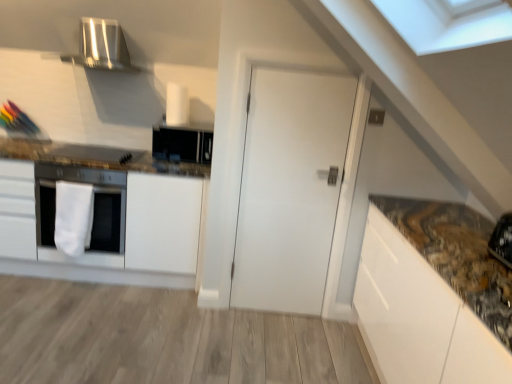
Describe the element at coordinates (93, 213) in the screenshot. I see `white matte oven at left` at that location.

The height and width of the screenshot is (384, 512). I want to click on white fabric towel at left, so click(x=73, y=217).

This screenshot has width=512, height=384. Find the location of `black matte microwave at upper center`. black matte microwave at upper center is located at coordinates (182, 144).

In order to face white matte cabinet at left, should I rotate leftwards or rightwards?

It's best to rotate left around 21.046 degrees.

This screenshot has width=512, height=384. Identify the location of white matte oven at left. (93, 213).

Is white fabric towel at left turned away from satin silver exhaust hood at upper left?

No, white fabric towel at left is not facing away from satin silver exhaust hood at upper left.

Visually, is white fabric towel at left positioned to the left or to the right of satin silver exhaust hood at upper left?

white fabric towel at left is positioned on satin silver exhaust hood at upper left's left side.

Which object is further away from the camera, white fabric towel at left or satin silver exhaust hood at upper left?

satin silver exhaust hood at upper left is more distant.

Is point (82, 196) closer to camera compared to point (88, 52)?

Yes, it is.

Where is `oven behind the white fabric towel at left`? oven behind the white fabric towel at left is located at coordinates (93, 213).

Is white fabric towel at left positioned behind white matte oven at left?

No, it is in front of white matte oven at left.

From a real-world perspective, which is physically above, white fabric towel at left or white matte oven at left?

In real-world perspective, white matte oven at left is above.

Is white fabric towel at left oriented away from white matte oven at left?

Yes, white matte oven at left is at the back of white fabric towel at left.

Looking at this image, between satin silver exhaust hood at upper left and black matte microwave at upper center, which one has smaller width?

black matte microwave at upper center is thinner.

Is satin silver exhaust hood at upper left placed right next to black matte microwave at upper center?

No, satin silver exhaust hood at upper left is not beside black matte microwave at upper center.

From the image's perspective, relative to black matte microwave at upper center, is satin silver exhaust hood at upper left above or below?

satin silver exhaust hood at upper left is situated higher than black matte microwave at upper center in the image.

Between satin silver exhaust hood at upper left and black matte microwave at upper center, which one has larger size?

With larger size is satin silver exhaust hood at upper left.

Does white matte oven at left have a larger size compared to satin silver exhaust hood at upper left?

Correct, white matte oven at left is larger in size than satin silver exhaust hood at upper left.

Which is farther, (90,261) or (126,51)?

The point (126,51) is farther.

Can you confirm if white matte oven at left is taller than satin silver exhaust hood at upper left?

Yes.

Is satin silver exhaust hood at upper left to the right of white matte cabinet at left from the viewer's perspective?

Yes.

Is satin silver exhaust hood at upper left positioned far away from white matte cabinet at left?

satin silver exhaust hood at upper left is near white matte cabinet at left, not far away.

Which is less distant, (x=118, y=49) or (x=110, y=274)?

The point (x=110, y=274) is more forward.

From the image's perspective, is white matte oven at left below black matte microwave at upper center?

Correct, white matte oven at left appears lower than black matte microwave at upper center in the image.

Consider the image. Is white matte oven at left located outside black matte microwave at upper center?

Indeed, white matte oven at left is completely outside black matte microwave at upper center.

Are white matte oven at left and black matte microwave at upper center making contact?

white matte oven at left is not next to black matte microwave at upper center, and they're not touching.

Looking at their sizes, would you say white matte oven at left is wider or thinner than black matte microwave at upper center?

white matte oven at left is wider than black matte microwave at upper center.

From a real-world perspective, who is located lower, white matte oven at left or white matte door at center?

white matte oven at left, from a real-world perspective.

Between white matte oven at left and white matte door at center, which one has larger width?

With larger width is white matte oven at left.

From the image's perspective, is white matte oven at left under white matte door at center?

Result: Indeed, from the image's perspective, white matte oven at left is shown beneath white matte door at center.

Could you tell me if white matte oven at left is turned towards white matte door at center?

No, white matte oven at left is not facing towards white matte door at center.

Image resolution: width=512 pixels, height=384 pixels. Identify the location of exhaust hood above the white fabric towel at left (from a real-world perspective). (102, 47).

Locate an element on the screen. oven on the right of the white fabric towel at left is located at coordinates (93, 213).

Looking at the image, which one is located further to white matte door at center, white matte oven at left or black matte microwave at upper center?

white matte oven at left is positioned further to the anchor white matte door at center.

When comparing their distances from white matte cabinet at left, does white fabric towel at left or white matte oven at left seem further?

Among the two, white fabric towel at left is located further to white matte cabinet at left.

Looking at the image, which one is located further to black matte microwave at upper center, satin silver exhaust hood at upper left or white fabric towel at left?

Among the two, satin silver exhaust hood at upper left is located further to black matte microwave at upper center.

When comparing their distances from white matte cabinet at left, does white matte oven at left or white fabric towel at left seem closer?

white matte oven at left lies closer to white matte cabinet at left than the other object.

Consider the image. From the image, which object appears to be farther from white fabric towel at left, white matte cabinet at left or satin silver exhaust hood at upper left?

satin silver exhaust hood at upper left is positioned further to the anchor white fabric towel at left.

From the image, which object appears to be farther from black matte microwave at upper center, white matte oven at left or white matte cabinet at left?

white matte oven at left lies further to black matte microwave at upper center than the other object.

From the image, which object appears to be farther from white matte cabinet at left, white fabric towel at left or white matte door at center?

The object further to white matte cabinet at left is white matte door at center.

Estimate the real-world distances between objects in this image. Which object is further from white matte door at center, black matte microwave at upper center or white matte cabinet at left?

Based on the image, white matte cabinet at left appears to be further to white matte door at center.

The height and width of the screenshot is (384, 512). What are the coordinates of `oven between satin silver exhaust hood at upper left and white matte cabinet at left vertically` in the screenshot? It's located at (93, 213).

Locate an element on the screen. cabinetry between white matte oven at left and white fabric towel at left from top to bottom is located at coordinates (115, 215).

Locate an element on the screen. The height and width of the screenshot is (384, 512). appliance between satin silver exhaust hood at upper left and white matte oven at left from top to bottom is located at coordinates (182, 144).

The width and height of the screenshot is (512, 384). I want to click on oven between white matte cabinet at left and white matte door at center, so click(93, 213).